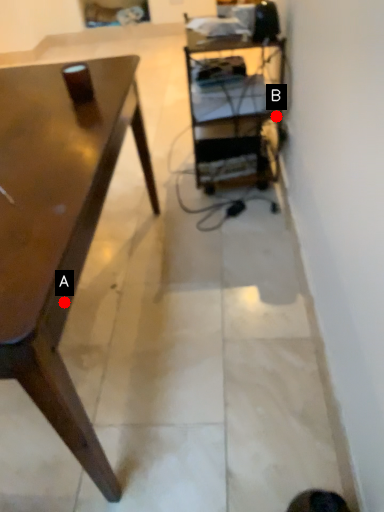
Question: Two points are circled on the image, labeled by A and B beside each circle. Which point appears farthest from the camera in this image?

Choices:
 (A) A is further
 (B) B is further

Answer: (B)